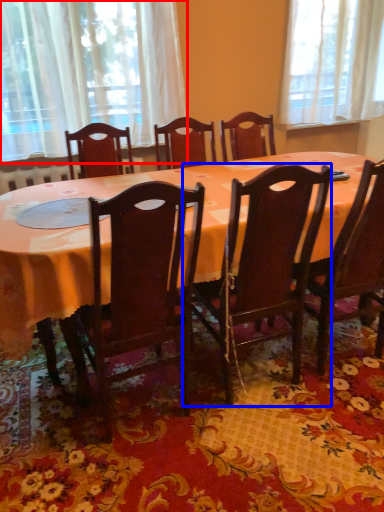
Question: Which of the following is the closest to the observer, curtain (highlighted by a red box) or chair (highlighted by a blue box)?

Choices:
 (A) curtain
 (B) chair

Answer: (B)